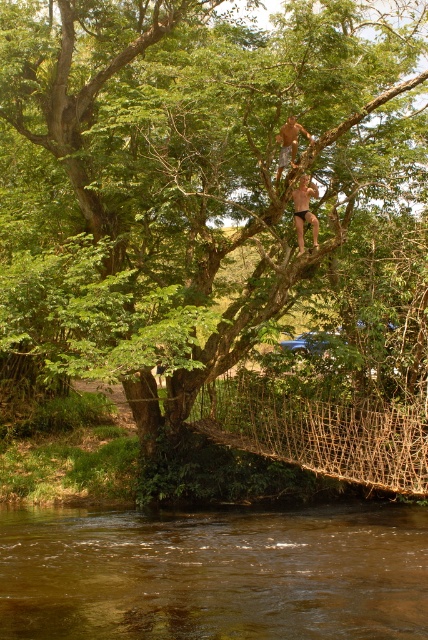
From the picture: You are planning to cross the brown woven rope bridge at lower center but want to ensure it is sturdy enough. Considering the size difference mentioned between the green leafy tree at upper center and the bridge, which object would you trust more to be stable?

The green leafy tree at upper center is larger in size than the brown woven rope bridge at lower center, so the tree would likely be more stable and trustworthy for support.

You are a parent looking at the scene and want to ensure the safety of the smooth skin child at upper center. Is the brown muddy water at lower center between the child and the nearest branch they could climb down to?

The brown muddy water at lower center is in front of the smooth skin child at upper center, so it is between the child and the nearest branch they could climb down to. This means the child would have to descend towards the water, which may pose a safety risk.